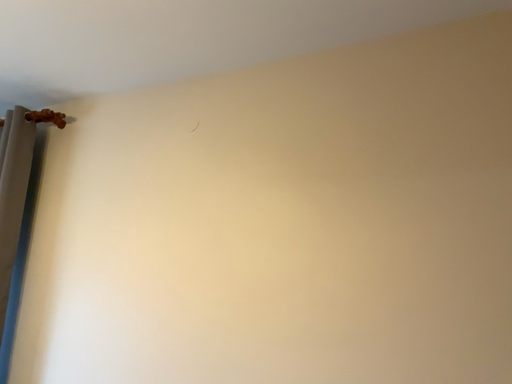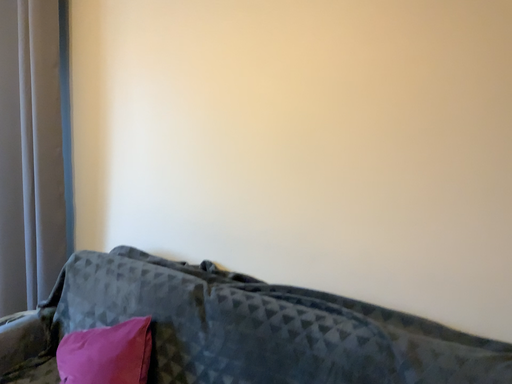
Question: Which way did the camera rotate in the video?

Choices:
 (A) rotated upward
 (B) rotated downward

Answer: (B)